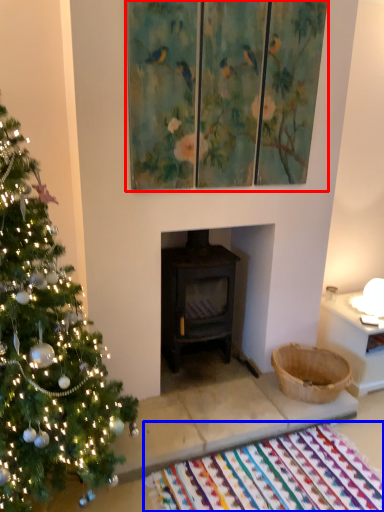
Question: Which object is further to the camera taking this photo, picture frame (highlighted by a red box) or mat (highlighted by a blue box)?

Choices:
 (A) picture frame
 (B) mat

Answer: (A)